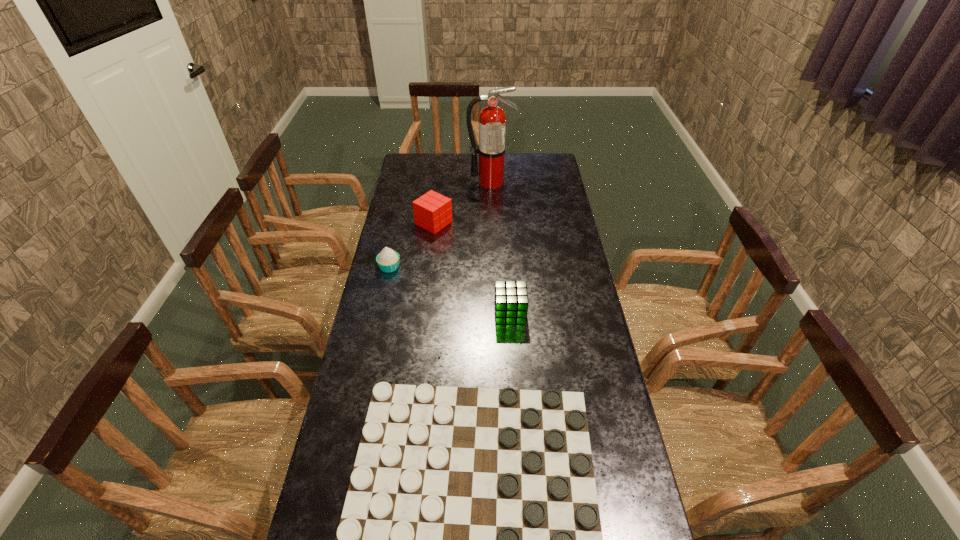
Where is `the tallest object`? The image size is (960, 540). the tallest object is located at coordinates (492, 120).

This screenshot has width=960, height=540. What are the coordinates of `the farthest object` in the screenshot? It's located at (492, 120).

The height and width of the screenshot is (540, 960). In order to click on the left cube in this screenshot , I will do `click(432, 211)`.

Identify the location of the farther cube. The height and width of the screenshot is (540, 960). (432, 211).

This screenshot has height=540, width=960. I want to click on the nearer cube, so click(x=511, y=303).

At what (x,y) coordinates should I click in order to perform the action: click on the right cube. Please return your answer as a coordinate pair (x, y). The height and width of the screenshot is (540, 960). Looking at the image, I should click on [x=511, y=303].

Locate an element on the screen. This screenshot has height=540, width=960. the third nearest object is located at coordinates (388, 260).

Image resolution: width=960 pixels, height=540 pixels. I want to click on free space located on the nozzle side of the tallest object, so click(492, 217).

Where is `free location located 0.350m on the right of the fourth nearest object`? The width and height of the screenshot is (960, 540). free location located 0.350m on the right of the fourth nearest object is located at coordinates (536, 223).

This screenshot has width=960, height=540. In order to click on vacant space situated on the right of the right cube in this screenshot , I will do `click(581, 313)`.